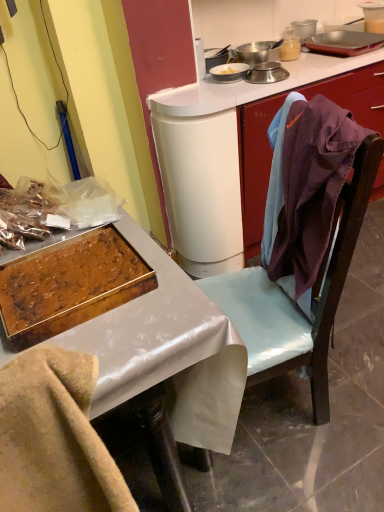
Where is `empty space that is to the right of metallic tray at left`? This screenshot has width=384, height=512. empty space that is to the right of metallic tray at left is located at coordinates (308, 423).